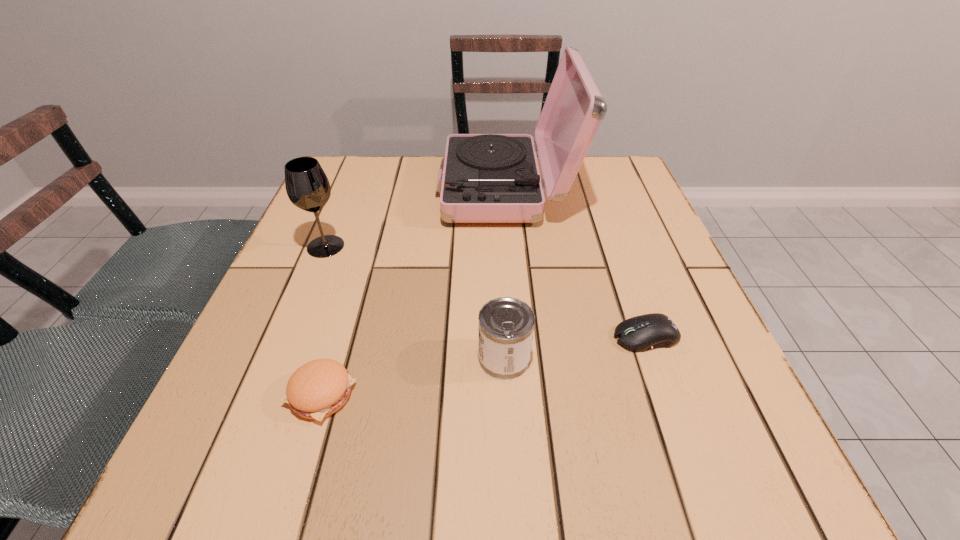
Find the location of a particular element. the tallest object is located at coordinates (487, 178).

Locate an element on the screen. The image size is (960, 540). the farthest object is located at coordinates (487, 178).

Identify the location of wineglass. (307, 186).

The width and height of the screenshot is (960, 540). I want to click on the second farthest object, so click(307, 186).

At what (x,y) coordinates should I click in order to perform the action: click on the third tallest object. Please return your answer as a coordinate pair (x, y). This screenshot has width=960, height=540. Looking at the image, I should click on (506, 325).

Find the location of a particular element. This screenshot has width=960, height=540. the fourth tallest object is located at coordinates (319, 388).

Locate an element on the screen. Image resolution: width=960 pixels, height=540 pixels. computer equipment is located at coordinates (641, 333).

This screenshot has height=540, width=960. What are the coordinates of `vacant space situated with the lid open on the record player` in the screenshot? It's located at (345, 188).

Identify the location of free region located with the lid open on the record player. This screenshot has height=540, width=960. pos(398,188).

Find the location of `free location located 0.310m on the front of the fourth nearest object`. free location located 0.310m on the front of the fourth nearest object is located at coordinates (271, 382).